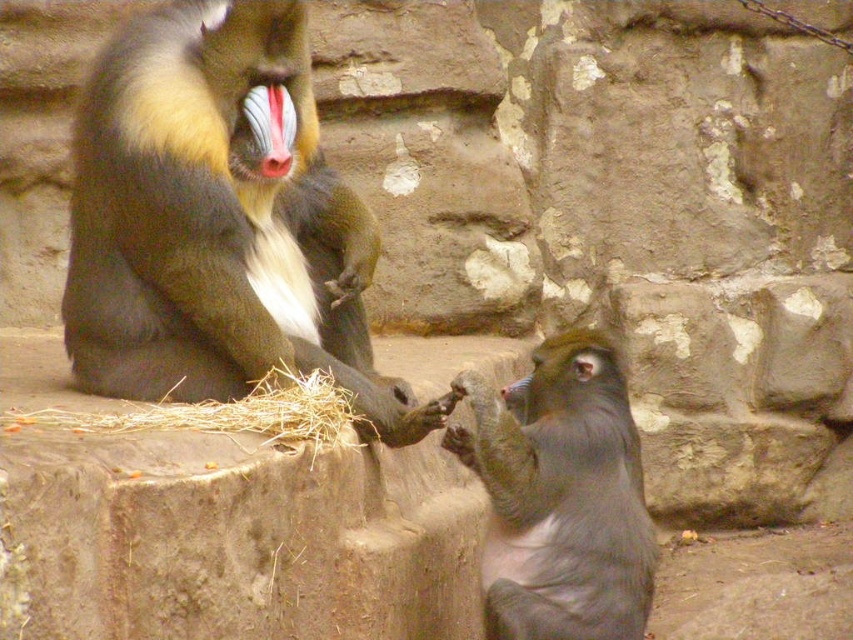
Based on the coordinates provided in the image, where is the shiny fur monkey at upper left located?

The shiny fur monkey at upper left is located at the 2D coordinates point (218, 220).